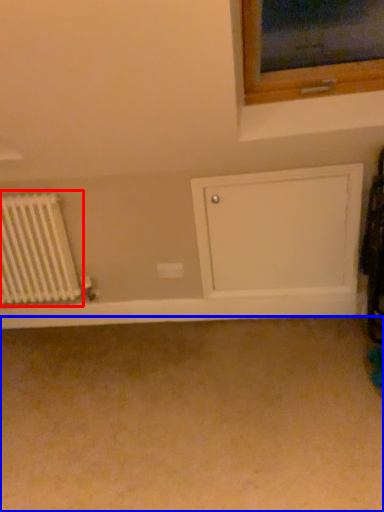
Question: Which object appears farthest to the camera in this image, radiator (highlighted by a red box) or plain (highlighted by a blue box)?

Choices:
 (A) radiator
 (B) plain

Answer: (A)